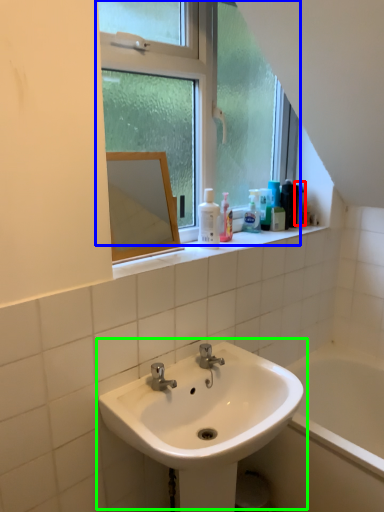
Question: Which is farther away from mouthwash (highlighted by a red box)? window (highlighted by a blue box) or sink (highlighted by a green box)?

Choices:
 (A) window
 (B) sink

Answer: (B)